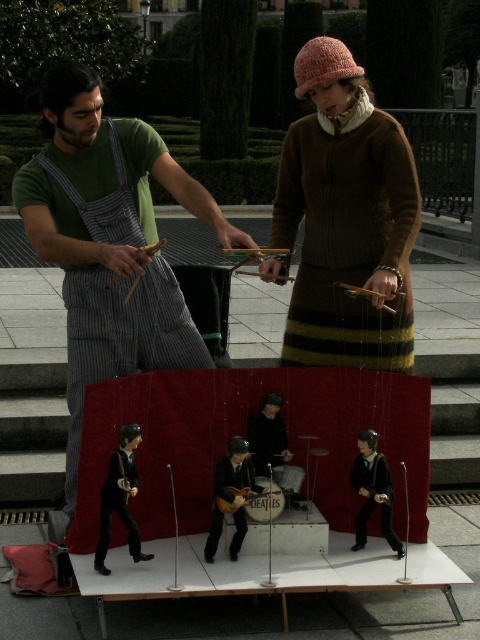
Is knitted brown sweater at center to the left of wooden acoustic guitar at center from the viewer's perspective?

In fact, knitted brown sweater at center is to the right of wooden acoustic guitar at center.

From the picture: Is knitted brown sweater at center thinner than wooden acoustic guitar at center?

No.

Is point (354, 244) positioned behind point (248, 492)?

Yes, point (354, 244) is farther from viewer.

Identify the location of knitted brown sweater at center. (346, 218).

Who is positioned more to the right, green cotton shirt at center or wooden acoustic guitar at center?

wooden acoustic guitar at center

Measure the distance from green cotton shirt at center to wooden acoustic guitar at center.

The distance of green cotton shirt at center from wooden acoustic guitar at center is 4.89 feet.

Does point (86, 320) come closer to viewer compared to point (252, 513)?

That is False.

At what (x,y) coordinates should I click in order to perform the action: click on green cotton shirt at center. Please return your answer as a coordinate pair (x, y). Looking at the image, I should click on (108, 241).

Who is taller, green cotton shirt at center or knitted brown sweater at center?

green cotton shirt at center

Can you confirm if green cotton shirt at center is bigger than knitted brown sweater at center?

Yes.

Find the location of `green cotton shirt at center`. green cotton shirt at center is located at coordinates (108, 241).